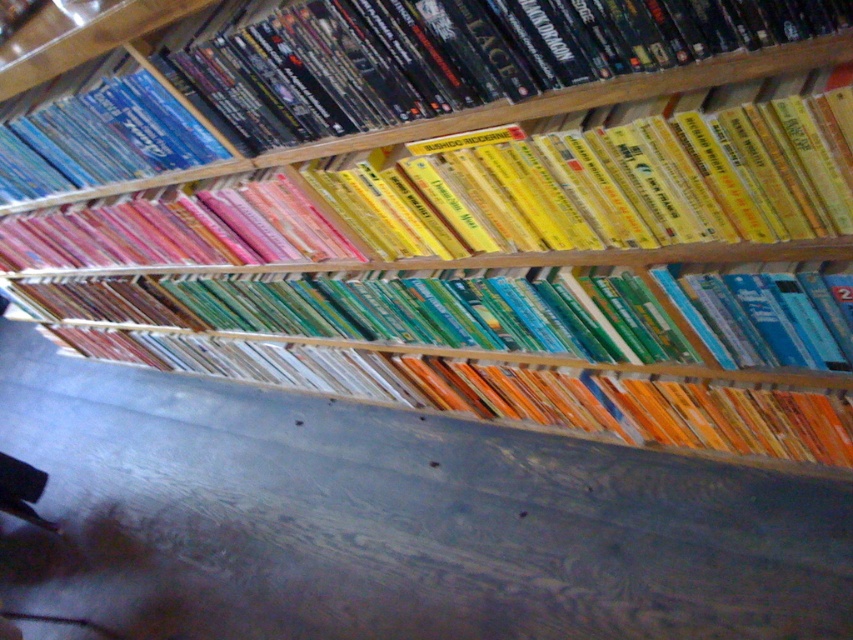
Can you confirm if matte black book at upper center is bigger than yellow matte book at upper center?

Incorrect, matte black book at upper center is not larger than yellow matte book at upper center.

Is matte black book at upper center positioned at the back of yellow matte book at upper center?

No, it is not.

Which is behind, point (579, 83) or point (653, 179)?

The point (653, 179) is more distant.

You are a GUI agent. You are given a task and a screenshot of the screen. Output one action in this format:
    pyautogui.click(x=<x>, y=<y>)
    Task: Click on the matte black book at upper center
    
    Given the screenshot: What is the action you would take?
    pyautogui.click(x=448, y=54)

Can you confirm if yellow matte book at upper center is positioned below blue glossy dvd at upper left?

Correct, yellow matte book at upper center is located below blue glossy dvd at upper left.

Is yellow matte book at upper center shorter than blue glossy dvd at upper left?

Indeed, yellow matte book at upper center has a lesser height compared to blue glossy dvd at upper left.

Which is behind, point (711, 147) or point (149, 170)?

Point (149, 170)

The height and width of the screenshot is (640, 853). Find the location of `yellow matte book at upper center`. yellow matte book at upper center is located at coordinates (616, 179).

Which is in front, point (260, 52) or point (20, 125)?

Positioned in front is point (260, 52).

I want to click on matte black book at upper center, so click(x=448, y=54).